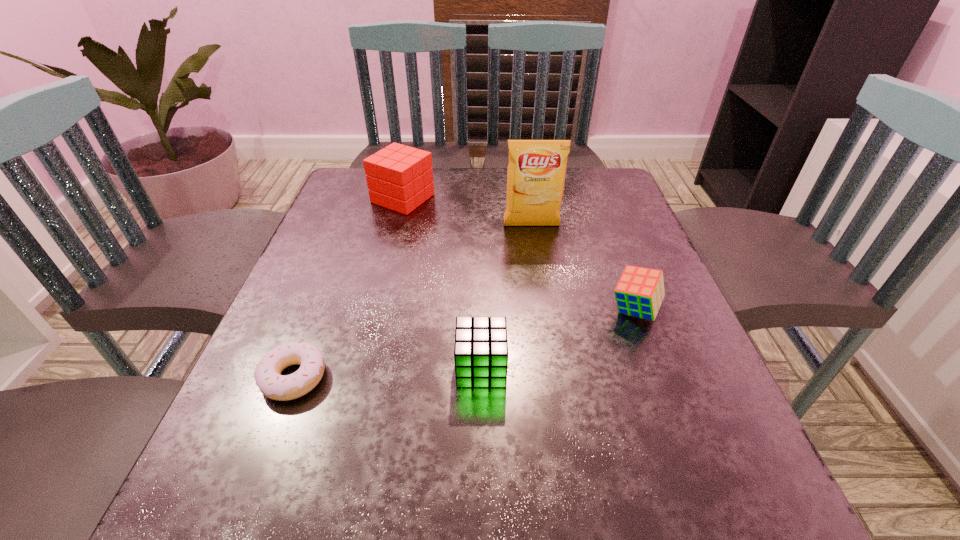
Locate an element on the screen. unoccupied position between the rightmost cube and the third object from left to right is located at coordinates (558, 339).

Locate an element on the screen. This screenshot has height=540, width=960. free spot between the leftmost cube and the doughnut is located at coordinates (348, 288).

Find the location of a particular element. empty space between the second farthest object and the farthest cube is located at coordinates click(x=468, y=212).

Where is `free space that is in between the third object from left to right and the third farthest object`? free space that is in between the third object from left to right and the third farthest object is located at coordinates (558, 339).

In order to click on object that can be found as the third closest to the third object from right to left in this screenshot , I will do `click(536, 173)`.

I want to click on the second closest object to the tallest cube, so click(268, 378).

The image size is (960, 540). I want to click on the second closest cube to the rightmost object, so click(x=399, y=177).

This screenshot has height=540, width=960. What are the coordinates of `the closest cube to the doughnut` in the screenshot? It's located at tap(481, 350).

Find the location of a particular element. This screenshot has width=960, height=540. vacant space that satisfies the following two spatial constraints: 1. on the back side of the doughnut; 2. on the right side of the nearest cube is located at coordinates point(298,367).

The height and width of the screenshot is (540, 960). Identify the location of free space that satisfies the following two spatial constraints: 1. on the front of the third farthest object with the logo; 2. on the left side of the crisp (potato chip). (544, 310).